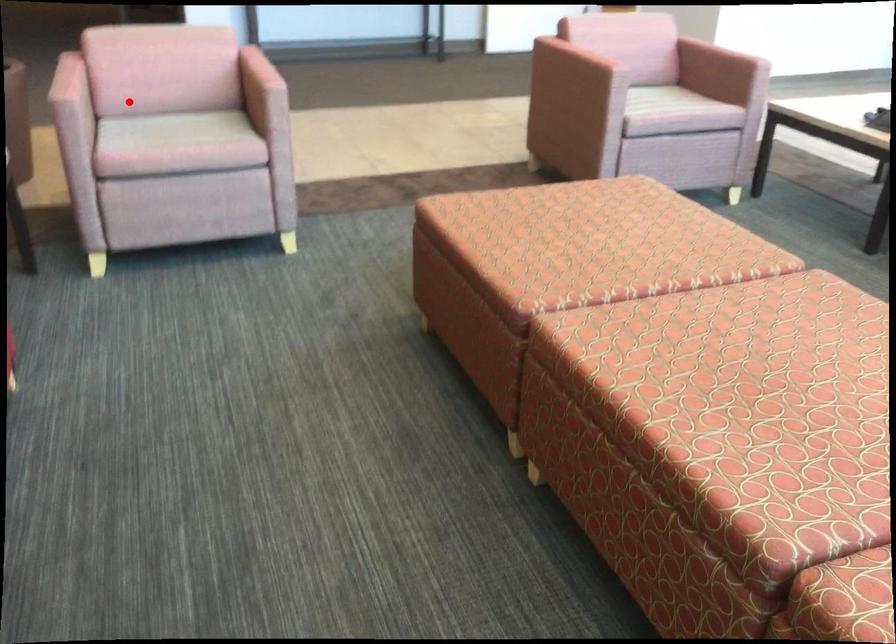
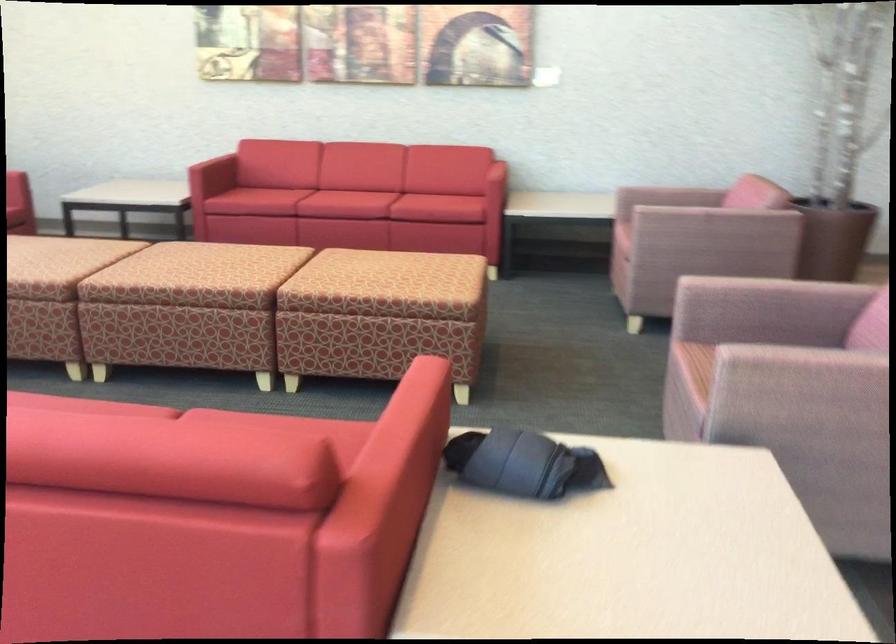
Where in the second image is the point corresponding to the highlighted location from the first image?

(669, 196)